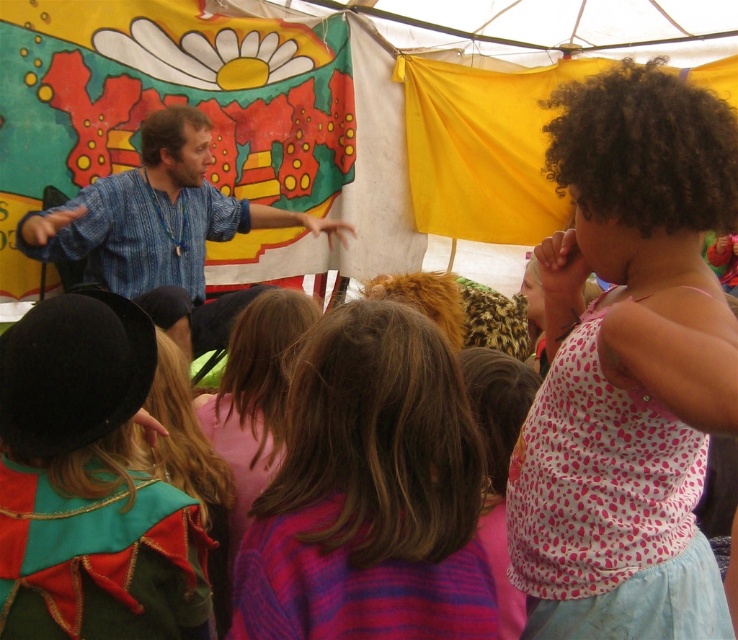
You are a photographer trying to capture a closeup shot of the velvet green cape at lower left and the blonde hair at center. Since you want to focus on both subjects, which one should you zoom in on first to ensure it fits in the frame?

The velvet green cape at lower left is smaller than the blonde hair at center, so you should zoom in on the velvet green cape at lower left first to ensure it fits in the frame before adjusting for the larger blonde hair at center.

You are a photographer trying to capture a photo of the man in the scene. You notice two clothing items worn by him that could be in your shot. The pink dotted tank top at upper right and the multicolored striped sweater at center. Which clothing item will appear larger in the photo?

The pink dotted tank top at upper right has a greater height compared to the multicolored striped sweater at center, so it will appear larger in the photo.